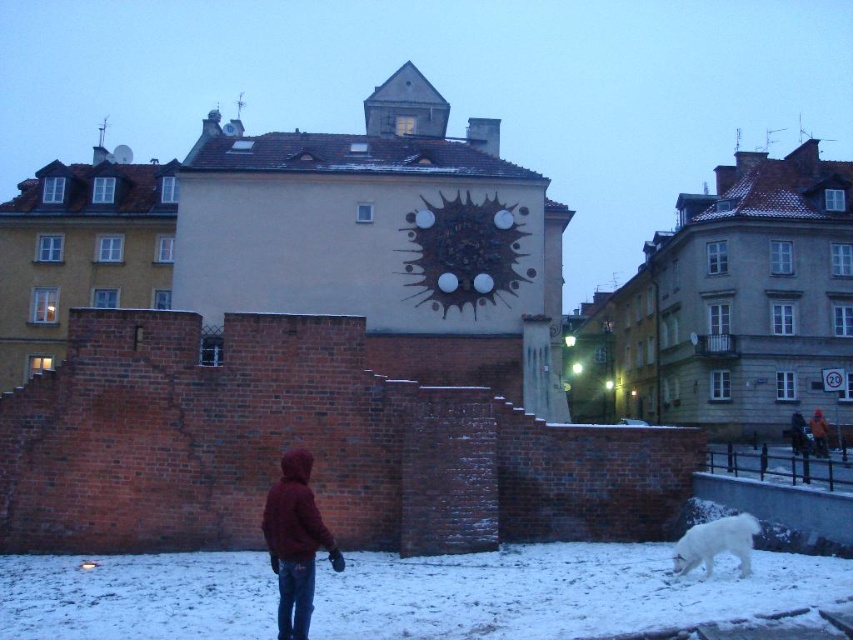
Is maroon hoodie at center to the right of red woolen jacket at center from the viewer's perspective?

In fact, maroon hoodie at center is to the left of red woolen jacket at center.

Is maroon hoodie at center taller than red woolen jacket at center?

Indeed, maroon hoodie at center has a greater height compared to red woolen jacket at center.

Identify the location of maroon hoodie at center. This screenshot has height=640, width=853. (294, 541).

Locate an element on the screen. This screenshot has width=853, height=640. white powdery snow at lower center is located at coordinates (556, 592).

Does white powdery snow at lower center have a larger size compared to maroon hoodie at center?

Yes.

Who is more distant from viewer, (457, 628) or (308, 515)?

Positioned behind is point (308, 515).

The width and height of the screenshot is (853, 640). Describe the element at coordinates (556, 592) in the screenshot. I see `white powdery snow at lower center` at that location.

At what (x,y) coordinates should I click in order to perform the action: click on white powdery snow at lower center. Please return your answer as a coordinate pair (x, y). Looking at the image, I should click on (556, 592).